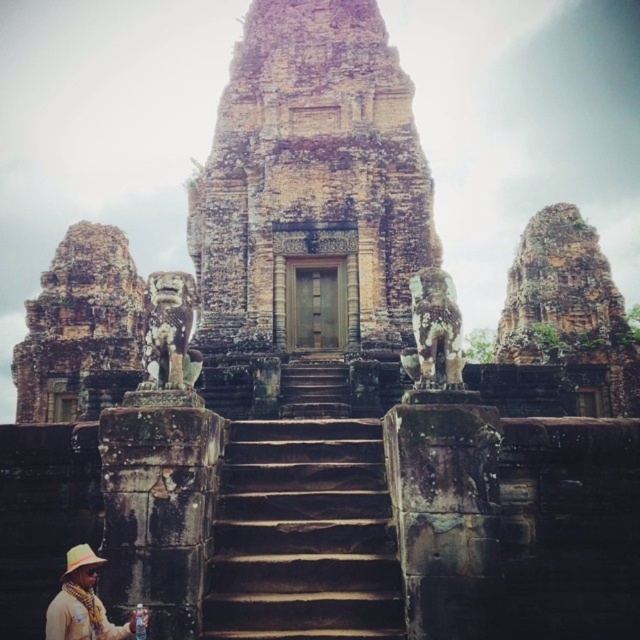
Can you confirm if brown stone temple at center is positioned below straw hat at lower left?

No.

Who is positioned more to the right, brown stone temple at center or straw hat at lower left?

From the viewer's perspective, brown stone temple at center appears more on the right side.

Who is more distant from viewer, (253, 248) or (84, 557)?

Point (253, 248)

Find the location of a particular element. The width and height of the screenshot is (640, 640). brown stone temple at center is located at coordinates (310, 186).

Can you confirm if brown stone stairs at center is wider than tan woven hat at lower left?

Indeed, brown stone stairs at center has a greater width compared to tan woven hat at lower left.

Does brown stone stairs at center have a smaller size compared to tan woven hat at lower left?

Incorrect, brown stone stairs at center is not smaller in size than tan woven hat at lower left.

Between point (369, 608) and point (68, 636), which one is positioned behind?

The point (369, 608) is more distant.

The image size is (640, 640). I want to click on brown stone stairs at center, so click(x=304, y=536).

Is brown stone temple at center further to the viewer compared to tan woven hat at lower left?

Yes, brown stone temple at center is further from the viewer.

Does brown stone temple at center have a larger size compared to tan woven hat at lower left?

Yes.

This screenshot has width=640, height=640. Describe the element at coordinates (310, 186) in the screenshot. I see `brown stone temple at center` at that location.

Where is `brown stone temple at center`? The image size is (640, 640). brown stone temple at center is located at coordinates (310, 186).